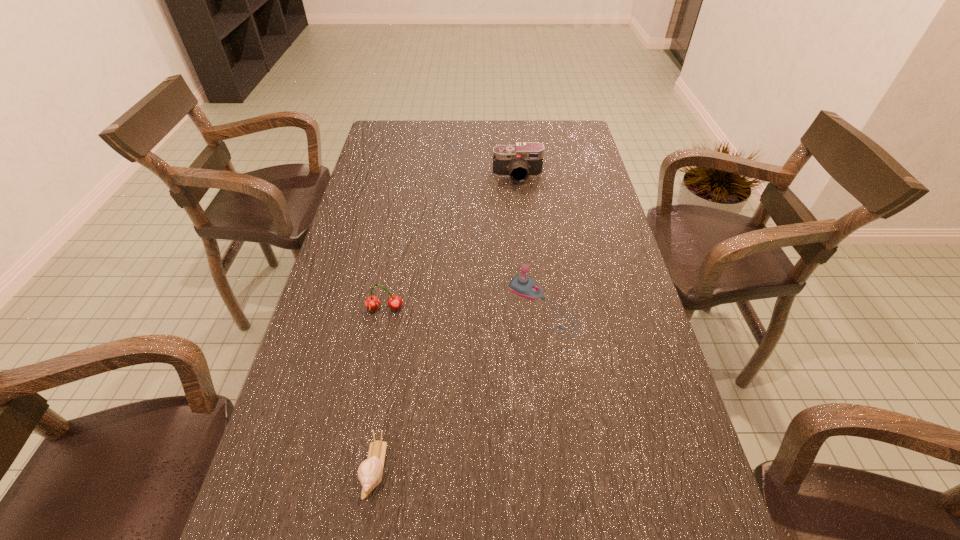
This screenshot has height=540, width=960. Find the location of `vacant space at the far edge of the desktop`. vacant space at the far edge of the desktop is located at coordinates (445, 139).

In order to click on free space at the left edge of the desktop in this screenshot , I will do `click(368, 195)`.

Locate an element on the screen. vacant space at the right edge of the desktop is located at coordinates (648, 354).

At what (x,y) coordinates should I click in order to perform the action: click on free region at the far left corner. Please return your answer as a coordinate pair (x, y). Looking at the image, I should click on (393, 149).

I want to click on vacant area that lies between the camera and the joystick, so (530, 241).

The width and height of the screenshot is (960, 540). Identify the location of free space between the nearest object and the joystick. (459, 387).

Locate an element on the screen. The width and height of the screenshot is (960, 540). free point between the joystick and the farthest object is located at coordinates (530, 241).

The width and height of the screenshot is (960, 540). In order to click on vacant space that's between the camera and the cherry in this screenshot , I will do `click(451, 242)`.

Where is `blank region between the farthest object and the nearest object`? This screenshot has width=960, height=540. blank region between the farthest object and the nearest object is located at coordinates (446, 322).

Find the location of a particular element. free space between the farthest object and the cherry is located at coordinates (451, 242).